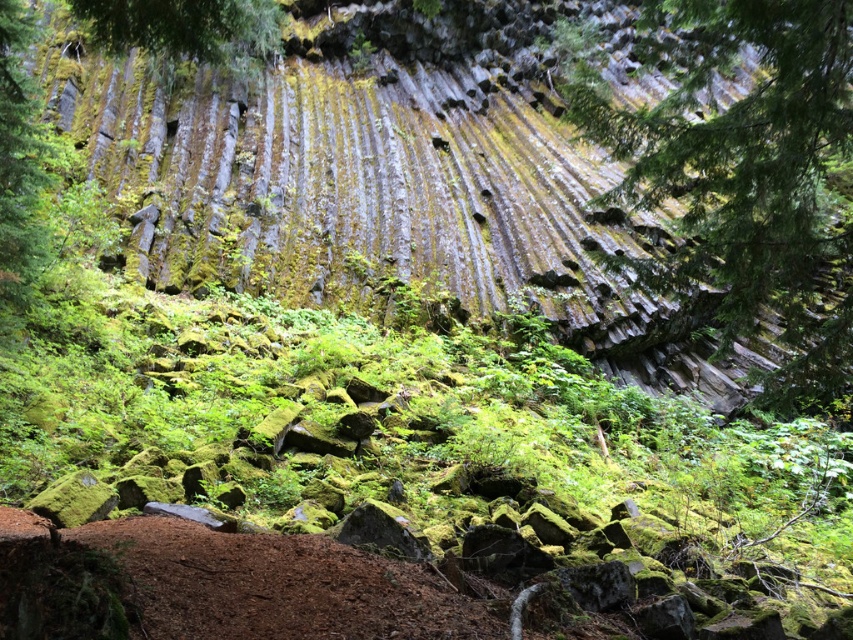
Between green mossy rock at upper right and green leafy tree at upper center, which one appears on the right side from the viewer's perspective?

From the viewer's perspective, green mossy rock at upper right appears more on the right side.

The height and width of the screenshot is (640, 853). I want to click on green mossy rock at upper right, so [747, 176].